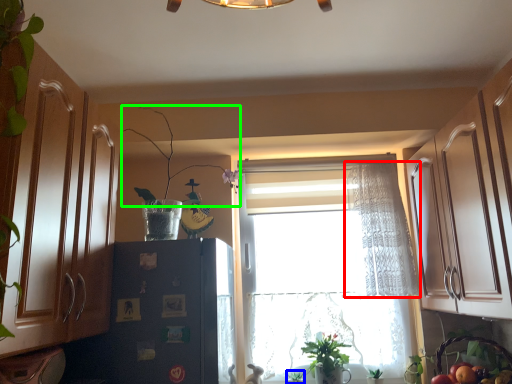
Question: Which object is the closest to the curtain (highlighted by a red box)? Choose among these: plant (highlighted by a blue box) or plant (highlighted by a green box).

Choices:
 (A) plant
 (B) plant

Answer: (B)